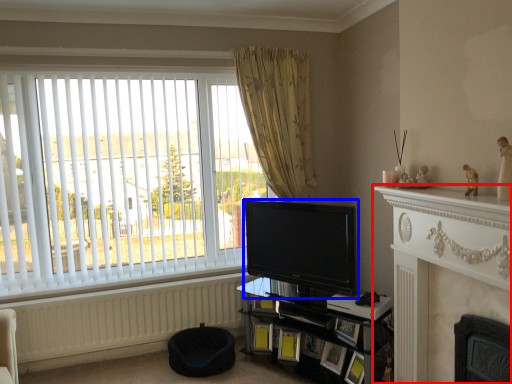
Question: Which object is further to the camera taking this photo, fireplace (highlighted by a red box) or television (highlighted by a blue box)?

Choices:
 (A) fireplace
 (B) television

Answer: (B)